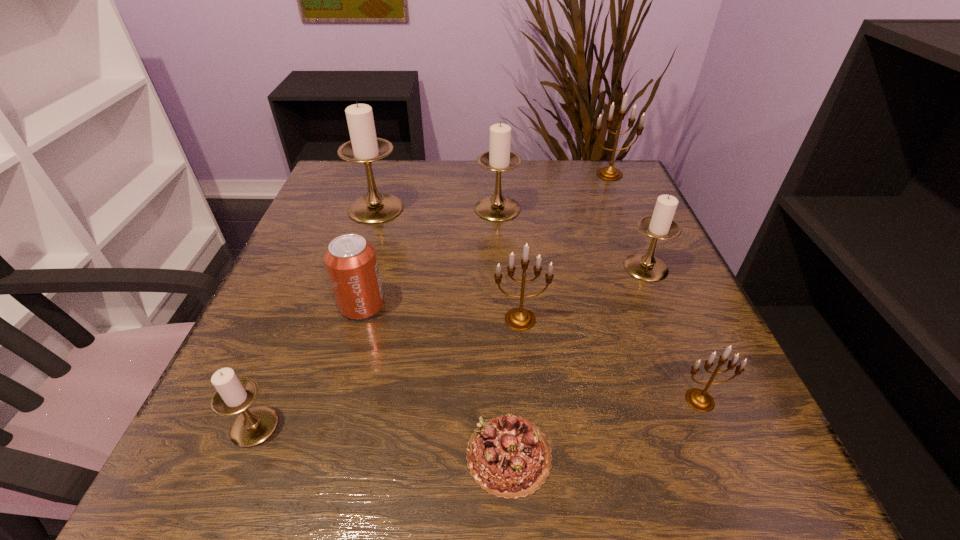
This screenshot has width=960, height=540. Find the location of `vacant space located 0.330m on the right of the nearest white candle holder`. vacant space located 0.330m on the right of the nearest white candle holder is located at coordinates (511, 426).

The image size is (960, 540). I want to click on vacant space located 0.170m on the left of the chocolate cake, so click(x=340, y=455).

I want to click on candle holder that is at the near edge, so click(x=234, y=395).

This screenshot has width=960, height=540. In order to click on chocolate cake that is at the near edge in this screenshot , I will do (x=509, y=457).

The width and height of the screenshot is (960, 540). Identify the location of can that is positioned at the left edge. (351, 262).

Where is `object at the far left corner`? The image size is (960, 540). object at the far left corner is located at coordinates (364, 147).

Where is `object positioned at the near left corner`? Image resolution: width=960 pixels, height=540 pixels. object positioned at the near left corner is located at coordinates (234, 395).

This screenshot has height=540, width=960. Find the location of `object that is positioned at the far right corner`. object that is positioned at the far right corner is located at coordinates (609, 173).

The width and height of the screenshot is (960, 540). Identify the location of free region at the far edge of the desktop. (471, 166).

Find the location of a particular element. Image resolution: width=960 pixels, height=540 pixels. vacant space at the near edge of the desktop is located at coordinates (467, 468).